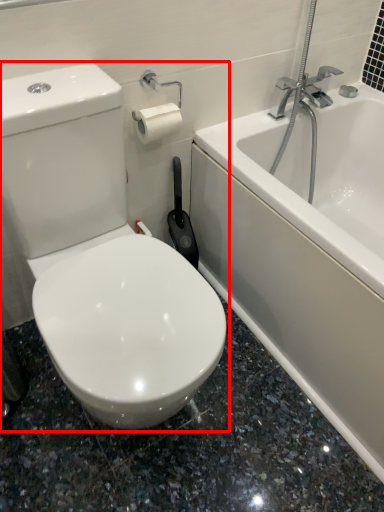
Question: In this image, where is toilet (annotated by the red box) located relative to bathtub?

Choices:
 (A) left
 (B) right

Answer: (A)